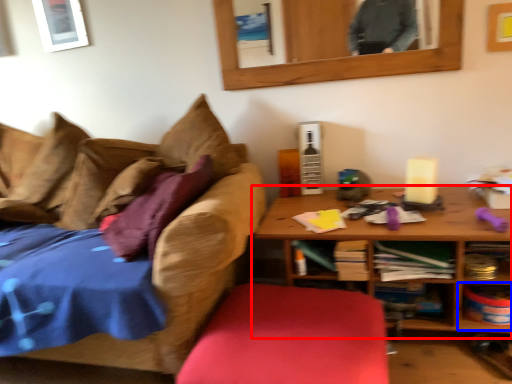
Question: Which object appears farthest to the camera in this image, table (highlighted by a red box) or shelf (highlighted by a blue box)?

Choices:
 (A) table
 (B) shelf

Answer: (B)